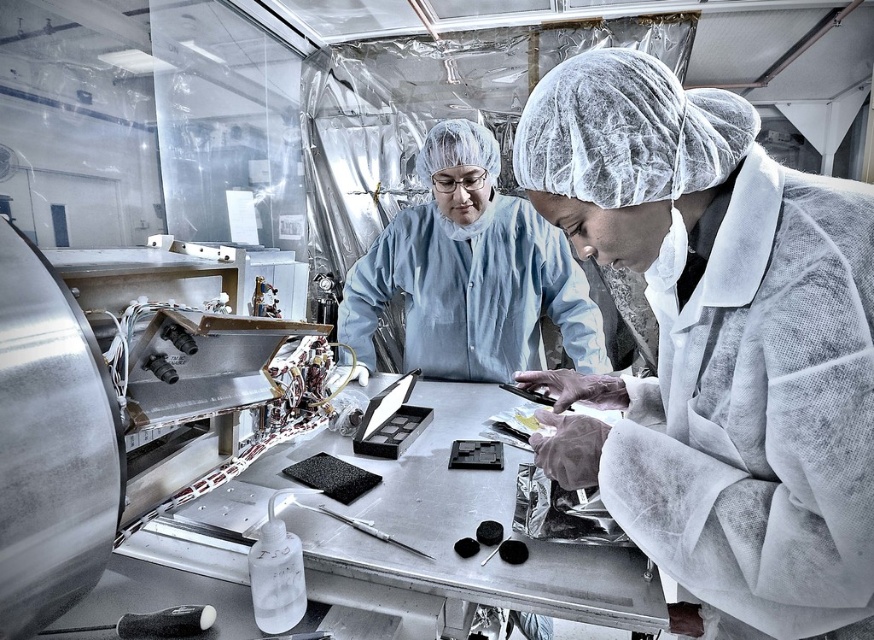
Question: Does white mesh robe at center have a greater width compared to blue fabric lab coat at center?

Choices:
 (A) no
 (B) yes

Answer: (A)

Question: Which of the following is the farthest from the observer?

Choices:
 (A) blue fabric lab coat at center
 (B) white mesh robe at center

Answer: (A)

Question: Which point is closer to the camera taking this photo?

Choices:
 (A) 656,436
 (B) 524,332

Answer: (A)

Question: Is white mesh robe at center closer to the viewer compared to blue fabric lab coat at center?

Choices:
 (A) no
 (B) yes

Answer: (B)

Question: Which object appears closest to the camera in this image?

Choices:
 (A) white mesh robe at center
 (B) blue fabric lab coat at center

Answer: (A)

Question: Is white mesh robe at center smaller than blue fabric lab coat at center?

Choices:
 (A) yes
 (B) no

Answer: (A)